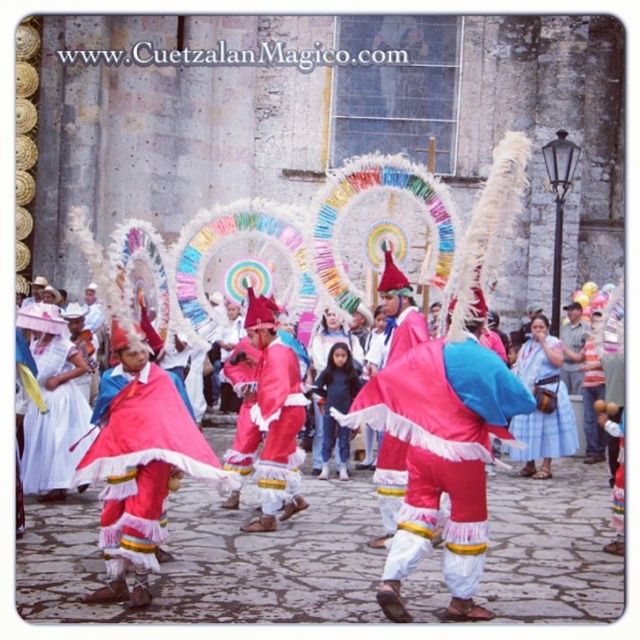
Question: Considering the relative positions of matte pink fabric at center and pink satin cape at center in the image provided, where is matte pink fabric at center located with respect to pink satin cape at center?

Choices:
 (A) left
 (B) right

Answer: (B)

Question: Which object appears closest to the camera in this image?

Choices:
 (A) pink satin cape at center
 (B) pink fabric costume at center

Answer: (A)

Question: Can you confirm if pink fabric costume at center is bigger than blue plaid skirt at center?

Choices:
 (A) yes
 (B) no

Answer: (B)

Question: Which object is positioned closest to the pink satin cape at center?

Choices:
 (A) matte pink fabric at center
 (B) blue plaid skirt at center

Answer: (A)

Question: Is pink fabric costume at center to the right of blue plaid skirt at center from the viewer's perspective?

Choices:
 (A) yes
 (B) no

Answer: (B)

Question: Which object appears closest to the camera in this image?

Choices:
 (A) pink satin cape at center
 (B) blue plaid skirt at center

Answer: (A)